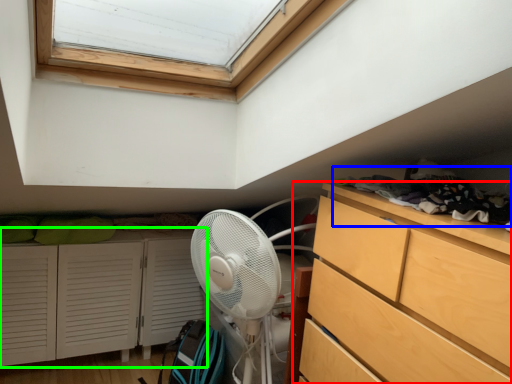
Question: Based on their relative distances, which object is farther from chest of drawers (highlighted by a red box)? Choose from laundry (highlighted by a blue box) and cupboard (highlighted by a green box).

Choices:
 (A) laundry
 (B) cupboard

Answer: (B)